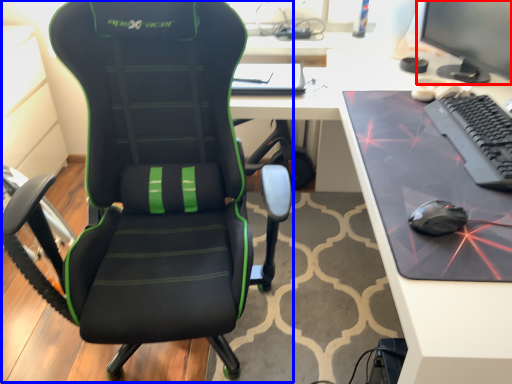
Question: Among these objects, which one is nearest to the camera, computer monitor (highlighted by a red box) or chair (highlighted by a blue box)?

Choices:
 (A) computer monitor
 (B) chair

Answer: (B)